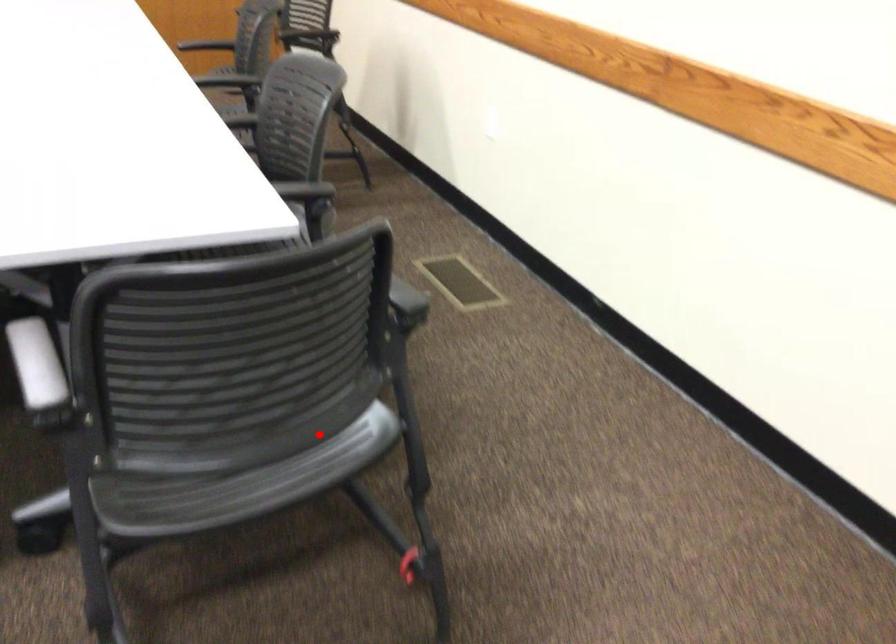
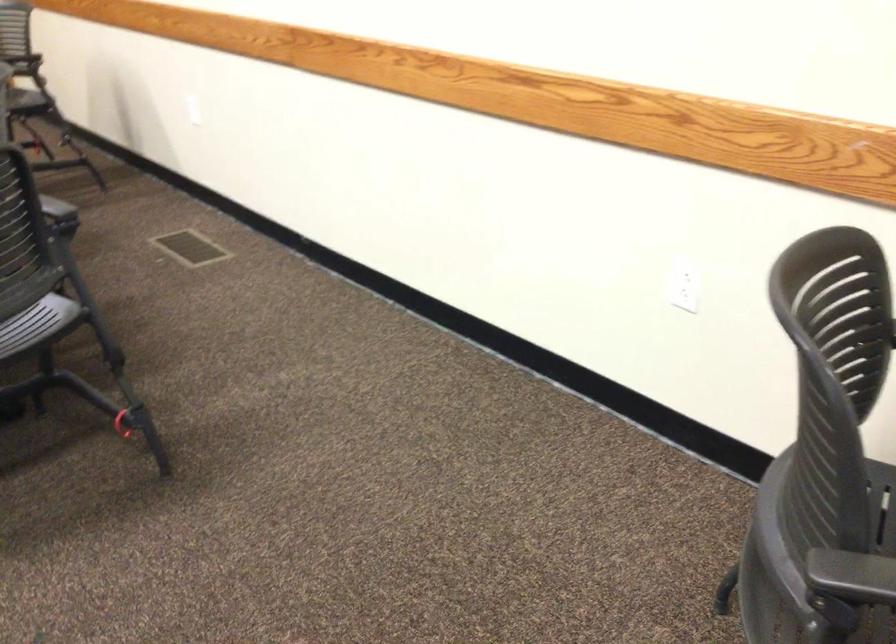
Locate, in the second image, the point that corresponds to the highlighted location in the first image.

(37, 323)